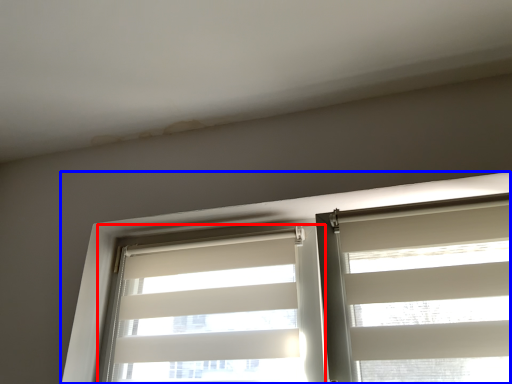
Question: Which object appears closest to the camera in this image, window blind (highlighted by a red box) or window (highlighted by a blue box)?

Choices:
 (A) window blind
 (B) window

Answer: (B)